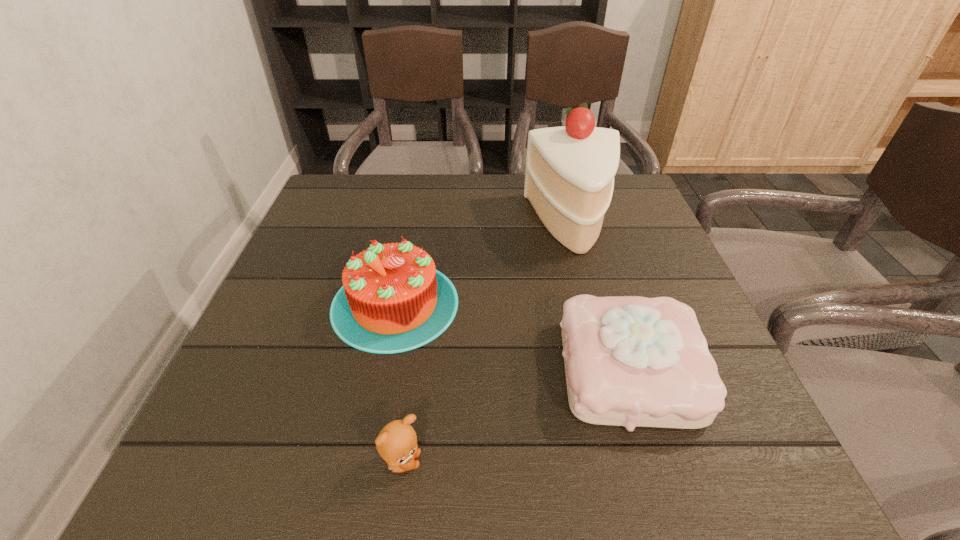
This screenshot has height=540, width=960. Identify the location of the tallest cake. (569, 180).

Where is `the farthest cake`? the farthest cake is located at coordinates (569, 180).

You are a GUI agent. You are given a task and a screenshot of the screen. Output one action in this format:
    pyautogui.click(x=<x>, y=<y>)
    Task: Click on the leftmost cake
    
    Given the screenshot: What is the action you would take?
    pyautogui.click(x=393, y=300)

The image size is (960, 540). In order to click on the second shortest cake in this screenshot , I will do `click(393, 300)`.

Where is `the shortest cake`? This screenshot has height=540, width=960. the shortest cake is located at coordinates (630, 361).

The image size is (960, 540). Identify the location of teddy bear. (397, 442).

The height and width of the screenshot is (540, 960). Identify the location of vacant region located 0.340m on the front of the farthest object. (615, 387).

At what (x,y) coordinates should I click in order to perform the action: click on blank space located 0.070m on the front of the second shortest cake. Please return your answer as a coordinate pair (x, y). The image size is (960, 540). Looking at the image, I should click on (378, 388).

Where is `free space located 0.050m on the front of the shortest cake`? This screenshot has height=540, width=960. free space located 0.050m on the front of the shortest cake is located at coordinates (660, 470).

Find the location of a particular element. free region located 0.160m on the face of the nearest object is located at coordinates (532, 462).